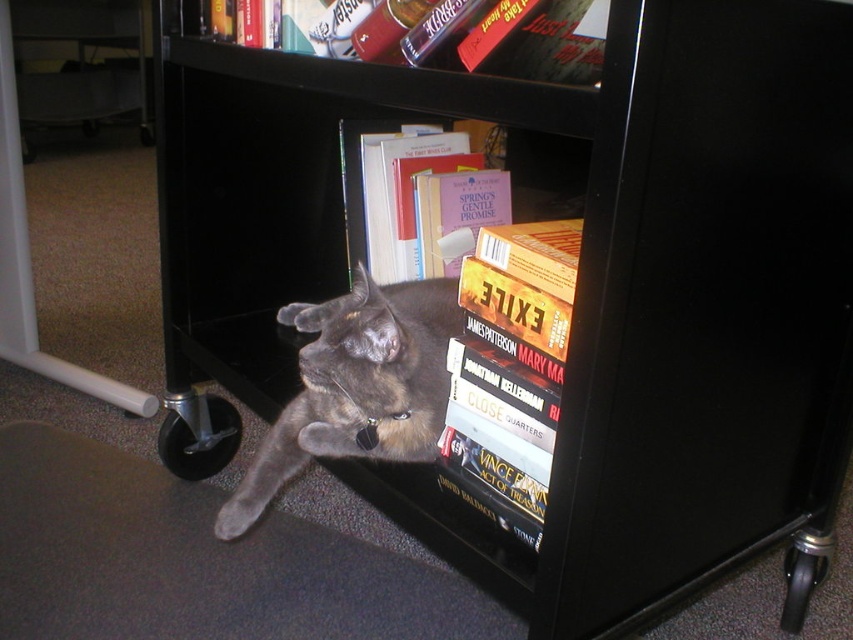
You are trying to move the black rolling bookshelf but need to ensure the gray fur cat at lower center won

The gray fur cat at lower center is located at point (195,561), which is near the edge of the shelf. Moving the bookshelf might disturb the cat, so it is advisable to gently move the cat to a safe location before attempting to roll the shelf.

In the scene shown: You are trying to move the black rolling bookshelf with wheels. You see the gray fur cat at lower center and the gray fur cat at center. Which cat is closer to the edge of the shelf where the wheels are located?

The gray fur cat at lower center is closer to the edge of the shelf where the wheels are located because it is positioned lower on the shelf compared to the gray fur cat at center.